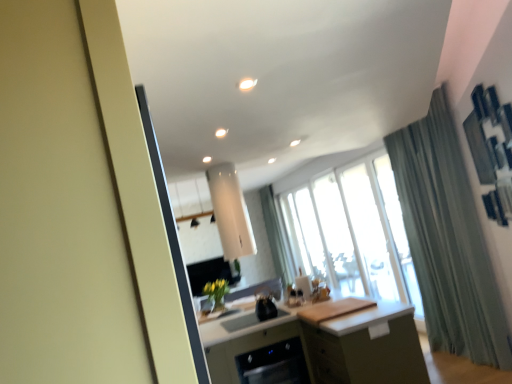
Question: Considering their positions, is white glossy light at upper center located in front of or behind green fabric curtain at right?

Choices:
 (A) front
 (B) behind

Answer: (A)

Question: From the image's perspective, relative to green fabric curtain at right, is white glossy light at upper center above or below?

Choices:
 (A) below
 (B) above

Answer: (B)

Question: Estimate the real-world distances between objects in this image. Which object is closer to the matte green cabinet at center?

Choices:
 (A) white glossy light at upper center
 (B) green fabric curtain at right
 (C) transparent glass window at center
 (D) black glossy dishwasher at lower center
 (E) matte white screen door at left

Answer: (D)

Question: Which object is the closest to the green fabric curtain at right?

Choices:
 (A) black glossy dishwasher at lower center
 (B) matte green cabinet at center
 (C) matte white screen door at left
 (D) transparent glass window at center
 (E) white glossy light at upper center

Answer: (D)